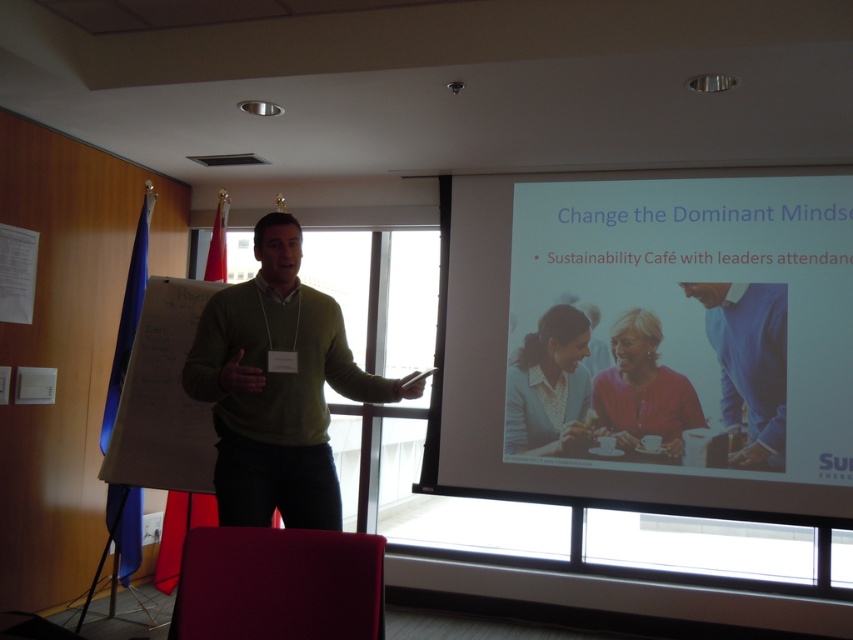
Is white glossy projector screen at upper center wider than blue cotton shirt at center?

Indeed, white glossy projector screen at upper center has a greater width compared to blue cotton shirt at center.

What do you see at coordinates (653, 339) in the screenshot? I see `white glossy projector screen at upper center` at bounding box center [653, 339].

Locate an element on the screen. white glossy projector screen at upper center is located at coordinates (x=653, y=339).

Looking at this image, who is positioned more to the right, green matte sweater at center or blue cotton shirt at center?

blue cotton shirt at center is more to the right.

The width and height of the screenshot is (853, 640). I want to click on green matte sweater at center, so click(x=277, y=387).

Where is `green matte sweater at center`? green matte sweater at center is located at coordinates (277, 387).

Is white glossy projector screen at upper center to the right of green matte sweater at center from the viewer's perspective?

Indeed, white glossy projector screen at upper center is positioned on the right side of green matte sweater at center.

Which of these two, white glossy projector screen at upper center or green matte sweater at center, stands shorter?

Result: With less height is green matte sweater at center.

Is point (776, 435) positioned in front of point (231, 460)?

No, (776, 435) is further to viewer.

Locate an element on the screen. white glossy projector screen at upper center is located at coordinates click(653, 339).